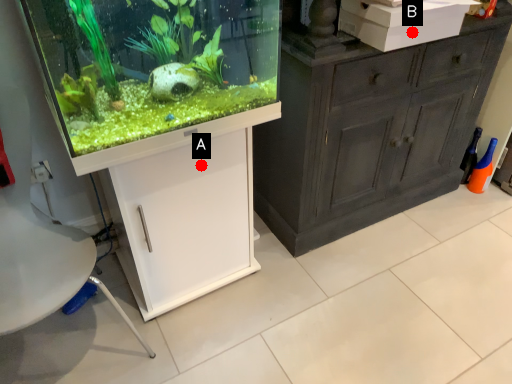
Question: Two points are circled on the image, labeled by A and B beside each circle. Which point is farther from the camera taking this photo?

Choices:
 (A) A is further
 (B) B is further

Answer: (B)